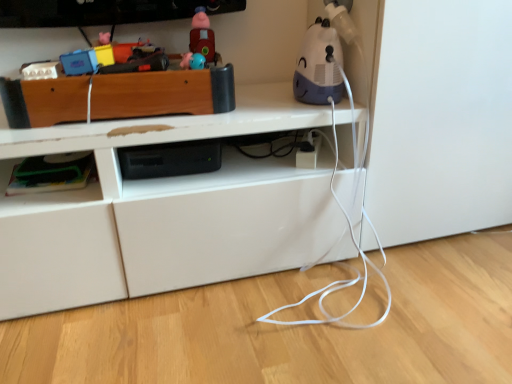
Find the location of a particular element. free spot above green plastic container at lower left, which is the 1th shelf from bottom to top (from a real-world perspective) is located at coordinates [50, 163].